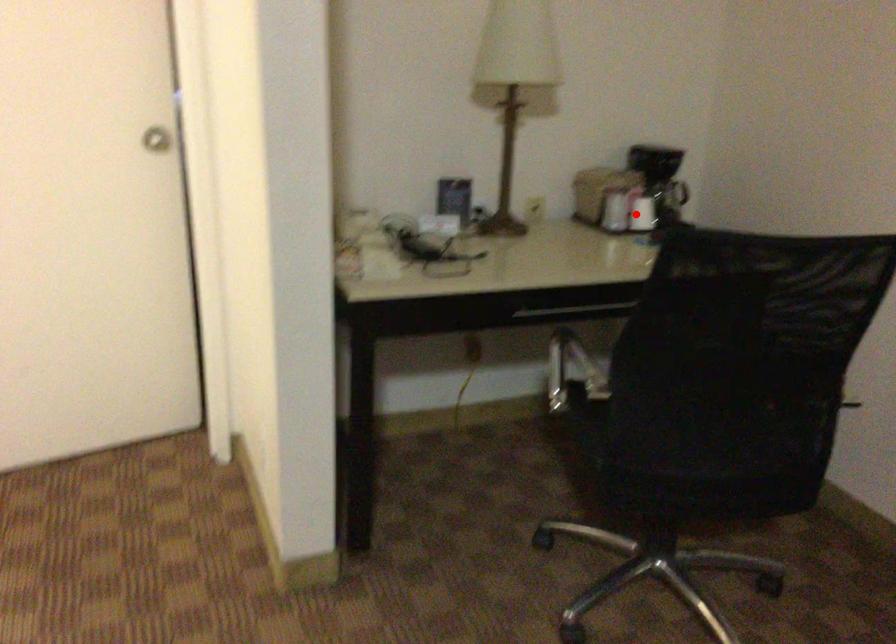
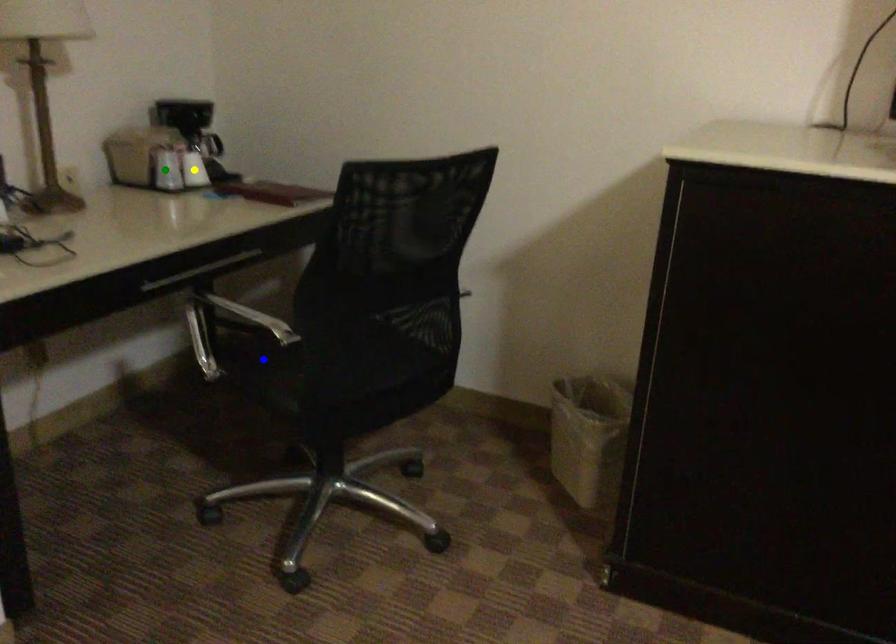
Question: I am providing you with two images of the same scene from different viewpoints. A red point is marked on the first image. You are given multiple points on the second image. Which spot in image 2 lines up with the point in image 1?

Choices:
 (A) yellow point
 (B) blue point
 (C) green point

Answer: (A)